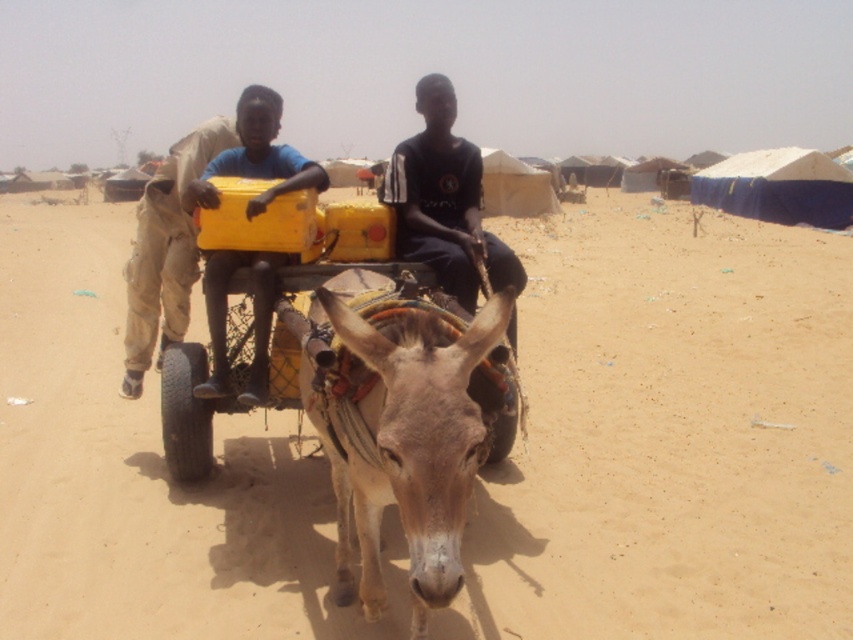
How much distance is there between brown sandy ground at center and black cotton shirt at center?

brown sandy ground at center and black cotton shirt at center are 20.83 feet apart.

Can you confirm if brown sandy ground at center is bigger than black cotton shirt at center?

Yes, brown sandy ground at center is bigger than black cotton shirt at center.

You are a GUI agent. You are given a task and a screenshot of the screen. Output one action in this format:
    pyautogui.click(x=<x>, y=<y>)
    Task: Click on the brown sandy ground at center
    Image resolution: width=853 pixels, height=640 pixels.
    Given the screenshot: What is the action you would take?
    671,435

Between point (160, 524) and point (299, 161), which one is positioned in front?

Point (160, 524) is in front.

Does point (809, 499) come farther from viewer compared to point (259, 316)?

Yes, it is behind point (259, 316).

Describe the element at coordinates (671, 435) in the screenshot. Image resolution: width=853 pixels, height=640 pixels. I see `brown sandy ground at center` at that location.

Where is `brown sandy ground at center`? This screenshot has height=640, width=853. brown sandy ground at center is located at coordinates (671, 435).

Does light brown textured mule at center come in front of black cotton shirt at center?

Yes, light brown textured mule at center is in front of black cotton shirt at center.

What do you see at coordinates (402, 438) in the screenshot? The width and height of the screenshot is (853, 640). I see `light brown textured mule at center` at bounding box center [402, 438].

This screenshot has height=640, width=853. I want to click on light brown textured mule at center, so click(x=402, y=438).